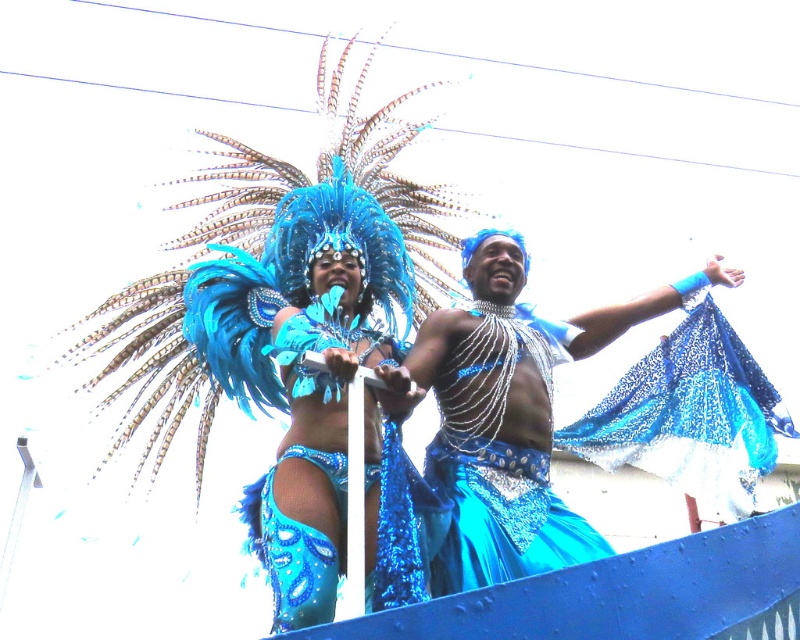
Is shiny blue costume at center taller than sparkly blue costume at center?

Yes, shiny blue costume at center is taller than sparkly blue costume at center.

Is shiny blue costume at center in front of sparkly blue costume at center?

That is True.

The image size is (800, 640). Describe the element at coordinates (322, 381) in the screenshot. I see `shiny blue costume at center` at that location.

The height and width of the screenshot is (640, 800). Identify the location of shiny blue costume at center. (322, 381).

The width and height of the screenshot is (800, 640). What do you see at coordinates (508, 413) in the screenshot? I see `sparkly blue costume at center` at bounding box center [508, 413].

Does sparkly blue costume at center have a lesser height compared to glittery blue fabric at center?

Incorrect, sparkly blue costume at center's height does not fall short of glittery blue fabric at center's.

Who is more distant from viewer, (452, 582) or (726, 496)?

The point (726, 496) is behind.

Find the location of a particular element. Image resolution: width=800 pixels, height=640 pixels. sparkly blue costume at center is located at coordinates (508, 413).

Who is taller, shiny blue costume at center or shiny blue fabric at center?

Standing taller between the two is shiny blue costume at center.

Does shiny blue costume at center appear on the left side of shiny blue fabric at center?

Yes, shiny blue costume at center is to the left of shiny blue fabric at center.

Image resolution: width=800 pixels, height=640 pixels. Describe the element at coordinates (322, 381) in the screenshot. I see `shiny blue costume at center` at that location.

Where is `shiny blue costume at center`? The height and width of the screenshot is (640, 800). shiny blue costume at center is located at coordinates (322, 381).